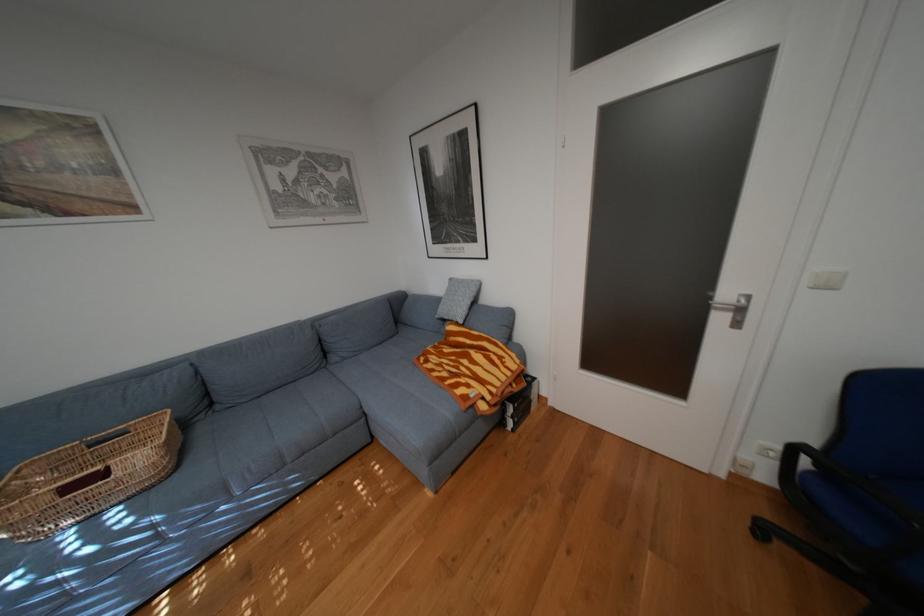
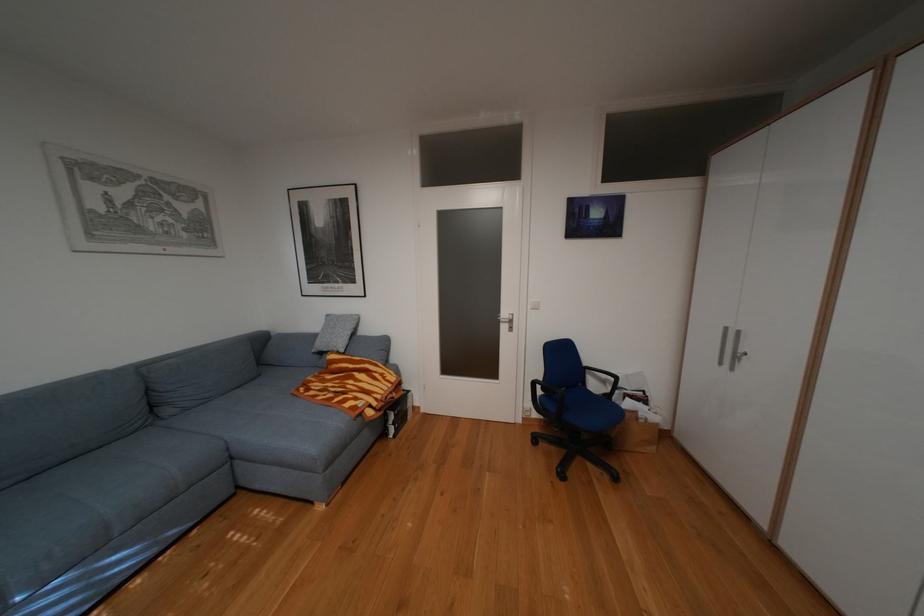
The point at (807, 448) is marked in the first image. Where is the corresponding point in the second image?

(545, 383)